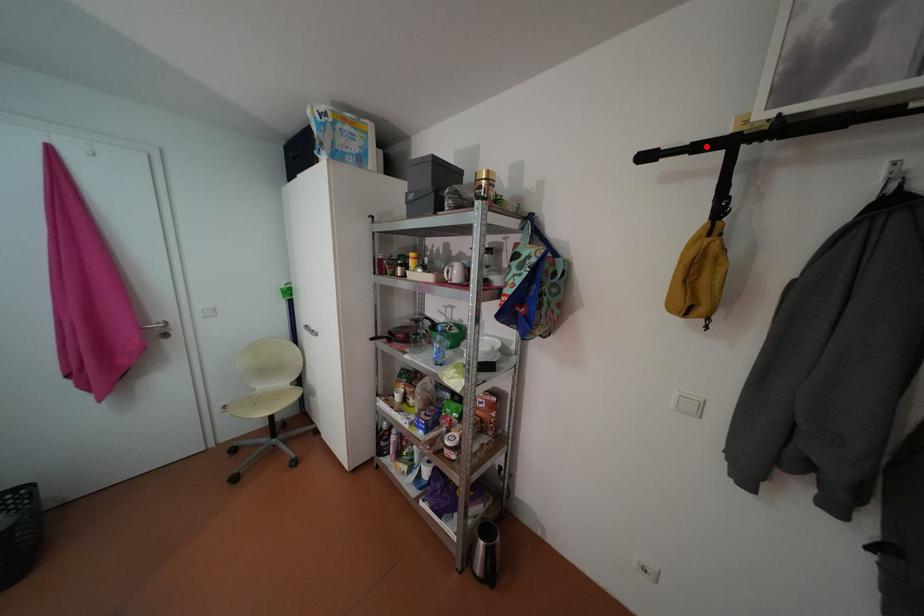
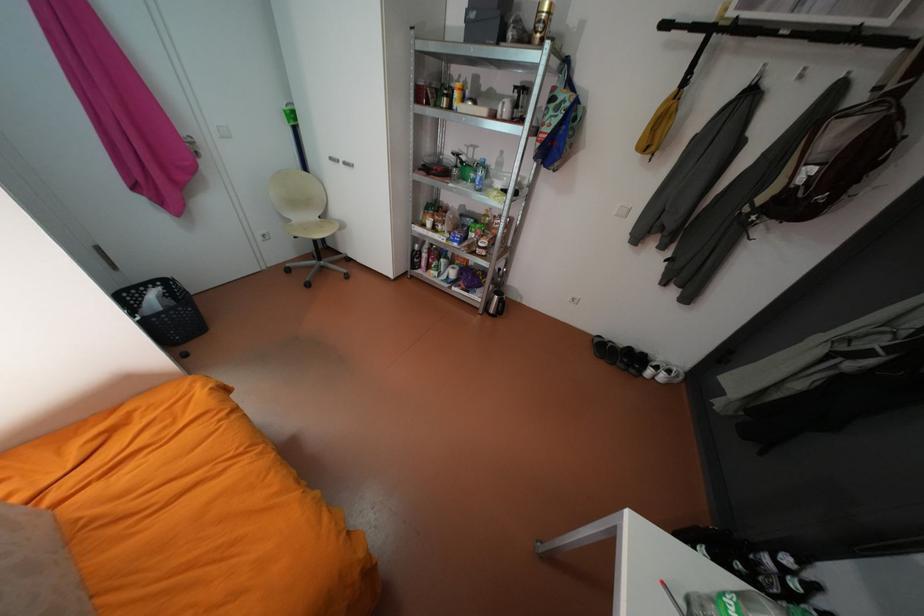
Find the pixel in the second image that matches the highlighted location in the first image.

(703, 26)